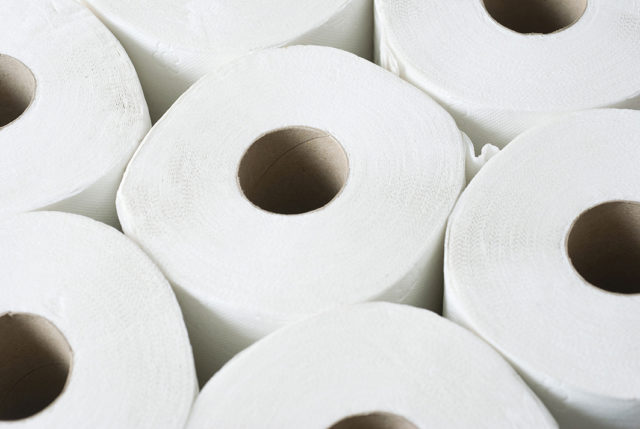
You are a GUI agent. You are given a task and a screenshot of the screen. Output one action in this format:
    pyautogui.click(x=<x>, y=<y>)
    Task: Click on the roll of toilet paper
    
    Given the screenshot: What is the action you would take?
    pyautogui.click(x=493, y=41), pyautogui.click(x=523, y=265), pyautogui.click(x=388, y=235), pyautogui.click(x=369, y=359), pyautogui.click(x=108, y=311), pyautogui.click(x=64, y=135), pyautogui.click(x=211, y=20)